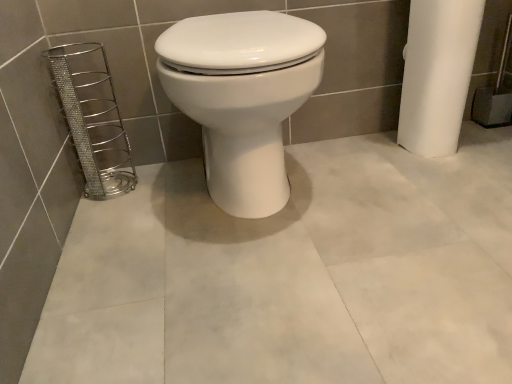
You are a GUI agent. You are given a task and a screenshot of the screen. Output one action in this format:
    pyautogui.click(x=<x>, y=<y>)
    Task: Click on the free spot in front of silver metallic wire basket at left
    
    Given the screenshot: What is the action you would take?
    pyautogui.click(x=111, y=213)